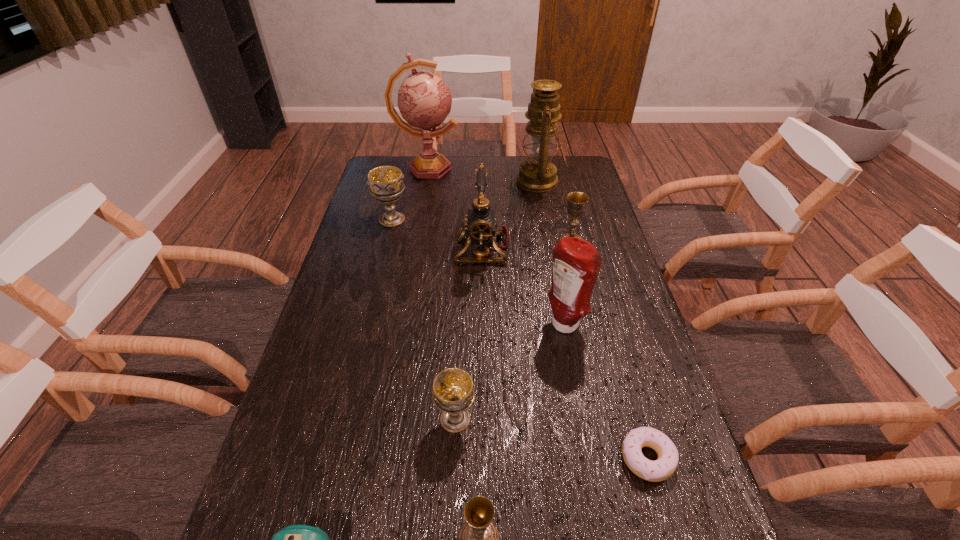
You are a GUI agent. You are given a task and a screenshot of the screen. Output one action in this format:
    pyautogui.click(x=<x>, y=<y>)
    Task: Click on the free spot located on the back of the farthest chalice
    This screenshot has width=960, height=540.
    Given the screenshot: What is the action you would take?
    pyautogui.click(x=397, y=197)

You are a GUI agent. You are given a task and a screenshot of the screen. Output one action in this format:
    pyautogui.click(x=<x>, y=<y>)
    Task: Click on the vacant area situated 0.230m on the right of the third farthest chalice
    The height and width of the screenshot is (540, 960).
    Given the screenshot: What is the action you would take?
    pyautogui.click(x=578, y=419)

Image resolution: width=960 pixels, height=540 pixels. I want to click on free space located 0.090m on the back of the doughnut, so click(631, 397).

This screenshot has width=960, height=540. I want to click on globe present at the far edge, so click(424, 100).

The width and height of the screenshot is (960, 540). I want to click on oil lamp present at the far edge, so click(x=537, y=174).

You are a GUI agent. You are given a task and a screenshot of the screen. Output one action in this format:
    pyautogui.click(x=<x>, y=<y>)
    Task: Click on the globe situated at the left edge
    The height and width of the screenshot is (540, 960).
    Given the screenshot: What is the action you would take?
    pyautogui.click(x=424, y=100)

Find the location of a particular element. chalice that is at the left edge is located at coordinates (385, 183).

I want to click on oil lamp that is at the right edge, so click(537, 174).

The width and height of the screenshot is (960, 540). In order to click on condiment that is at the right edge in this screenshot , I will do `click(576, 262)`.

In order to click on chalice positioned at the right edge in this screenshot , I will do `click(577, 201)`.